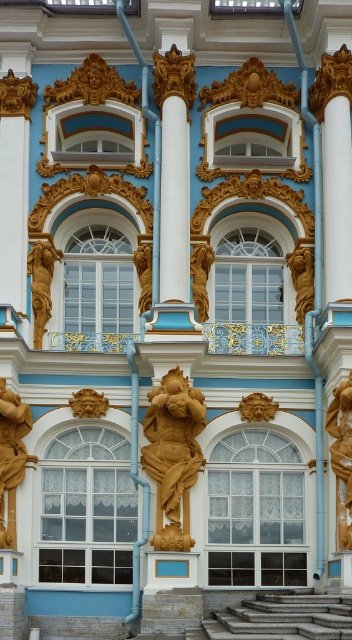
Does gold polished statue at left appear under gold/gilded statue at center?

Indeed, gold polished statue at left is positioned under gold/gilded statue at center.

Can you confirm if gold polished statue at left is positioned above gold/gilded statue at center?

No, gold polished statue at left is not above gold/gilded statue at center.

Locate an element on the screen. The height and width of the screenshot is (640, 352). gold polished statue at left is located at coordinates (10, 452).

Does gray stone stairs at lower center appear on the right side of gold polished statue at left?

Indeed, gray stone stairs at lower center is positioned on the right side of gold polished statue at left.

Does gray stone stairs at lower center have a lesser width compared to gold polished statue at left?

Incorrect, gray stone stairs at lower center's width is not less than gold polished statue at left's.

Locate an element on the screen. gray stone stairs at lower center is located at coordinates (280, 618).

Find the location of a particular element. gray stone stairs at lower center is located at coordinates (280, 618).

Between gray stone stairs at lower center and gold/gilded statue at left, which one is positioned higher?

gold/gilded statue at left is above.

Can you confirm if gray stone stairs at lower center is bigger than gold/gilded statue at left?

Yes, gray stone stairs at lower center is bigger than gold/gilded statue at left.

Describe the element at coordinates (280, 618) in the screenshot. I see `gray stone stairs at lower center` at that location.

The image size is (352, 640). Find the location of `gray stone stairs at lower center`. gray stone stairs at lower center is located at coordinates (280, 618).